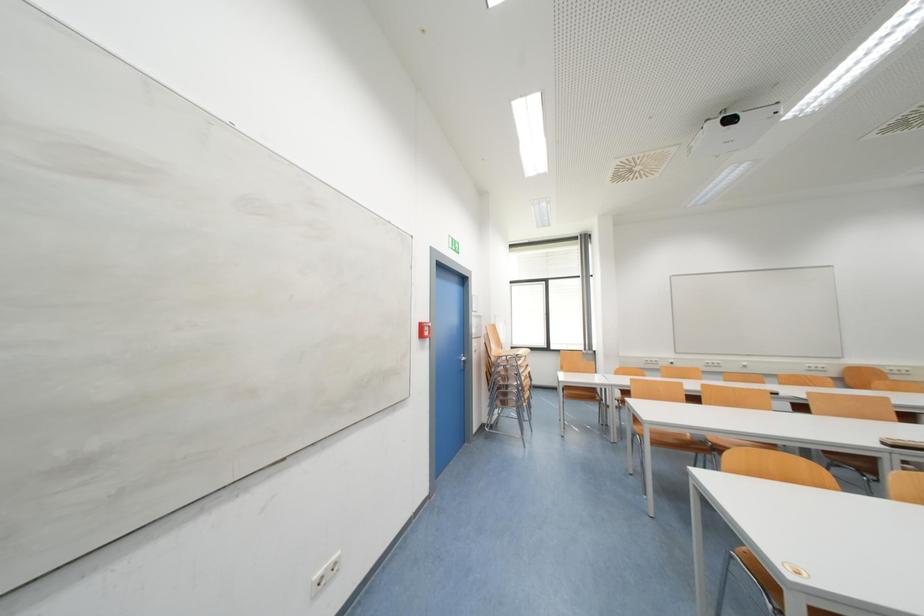
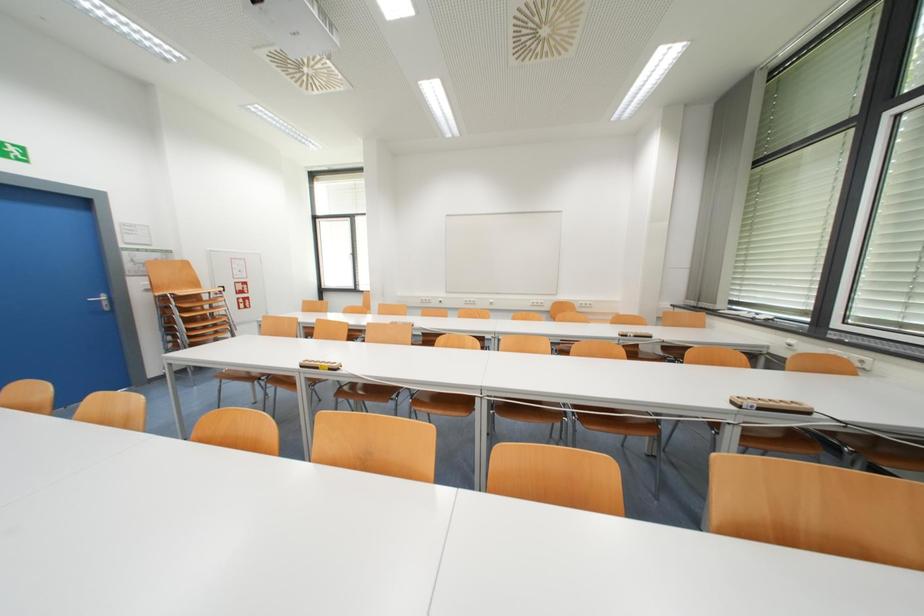
Question: Which direction would the cameraman need to move to produce the second image? Reply with the corresponding letter.

Choices:
 (A) Left
 (B) Right
 (C) Forward
 (D) Backward

Answer: (B)